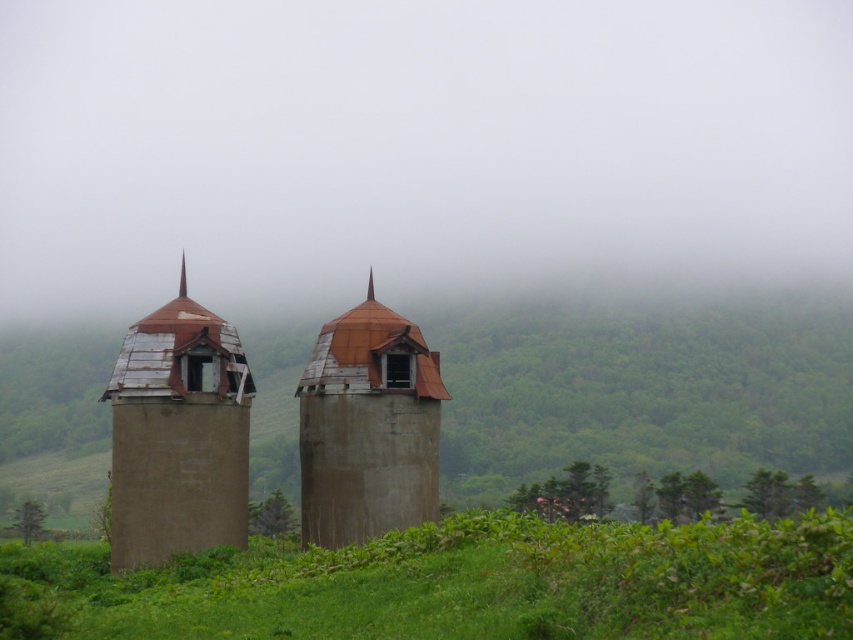
You are a landscape architect designing a new garden path. You need to know the spatial relationship between the rusty concrete towers at center and the green grassy at lower center. Which object is closer to the viewer?

The rusty concrete towers at center are closer to the viewer because the green grassy at lower center is behind them.

You are a maintenance worker assessing the condition of the two towers in the image. Which tower is positioned farther away from you, the rusty metal tower at left or the rusty concrete towers at center?

The rusty metal tower at left is farther away because it is positioned behind the rusty concrete towers at center.

You are standing at the origin point in the image. The rusty concrete towers at center are located at coordinates point 0.614, 0.754. To reach them, should you walk north or south?

The coordinates of the rusty concrete towers at center are at point (642, 392). Since the y coordinate is 0.754, which is closer to 1 than 0, you should walk north to reach them.